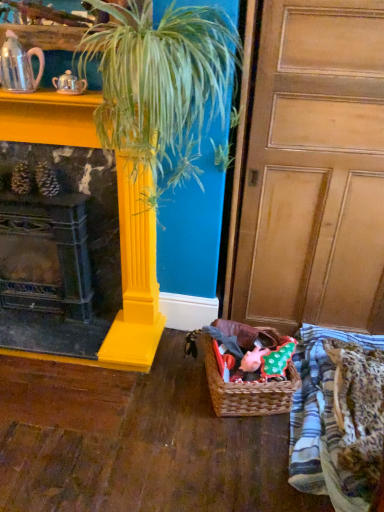
Find the location of a particular element. The width and height of the screenshot is (384, 512). vacant area on top of brown woven basket at lower right (from a real-world perspective) is located at coordinates (250, 355).